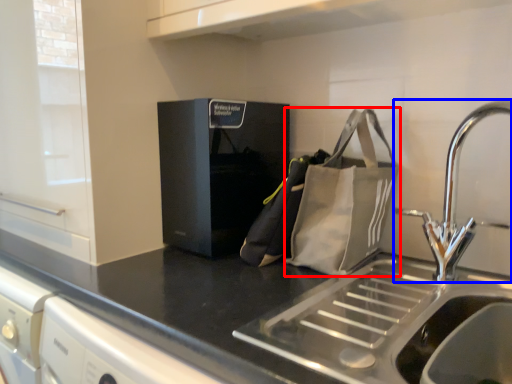
Question: Which object is closer to the camera taking this photo, pouch (highlighted by a red box) or tap (highlighted by a blue box)?

Choices:
 (A) pouch
 (B) tap

Answer: (B)